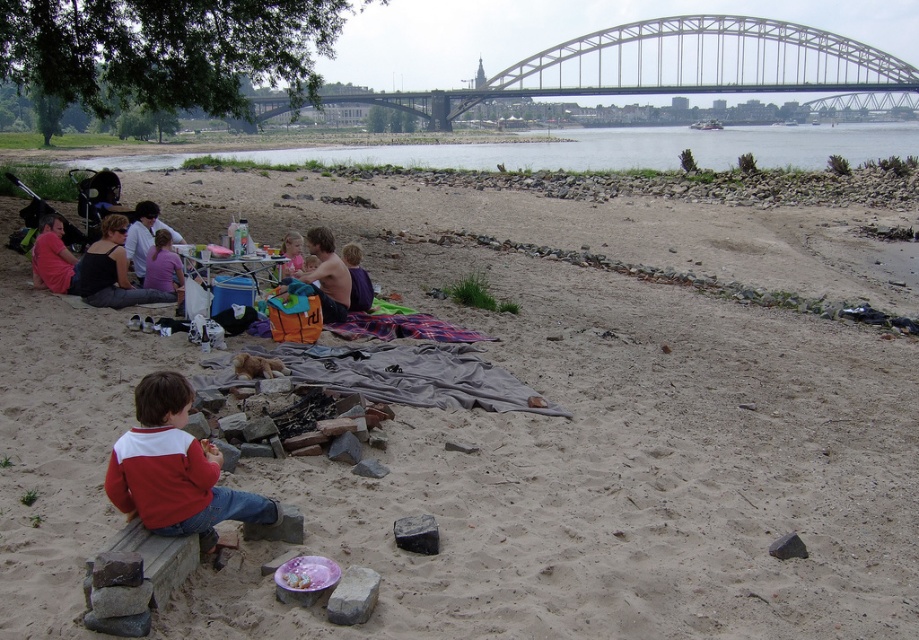
Which is behind, point (38, 269) or point (295, 234)?

Positioned behind is point (38, 269).

Is matte red shirt at left to the left of pastel pink fabric at center from the viewer's perspective?

Yes, matte red shirt at left is to the left of pastel pink fabric at center.

Does point (38, 269) come in front of point (293, 260)?

No, (38, 269) is behind (293, 260).

Identify the location of matte red shirt at left. (52, 257).

Is red cotton sweater at lower left bigger than matte red shirt at left?

Actually, red cotton sweater at lower left might be smaller than matte red shirt at left.

Which is more to the right, red cotton sweater at lower left or matte red shirt at left?

Positioned to the right is red cotton sweater at lower left.

What are the coordinates of `red cotton sweater at lower left` in the screenshot? It's located at (174, 467).

Does metallic gray bridge at upper center have a larger size compared to matte black tank top at left?

Yes, metallic gray bridge at upper center is bigger than matte black tank top at left.

Is point (825, 54) closer to camera compared to point (118, 275)?

That is False.

Locate an element on the screen. Image resolution: width=919 pixels, height=640 pixels. metallic gray bridge at upper center is located at coordinates (670, 65).